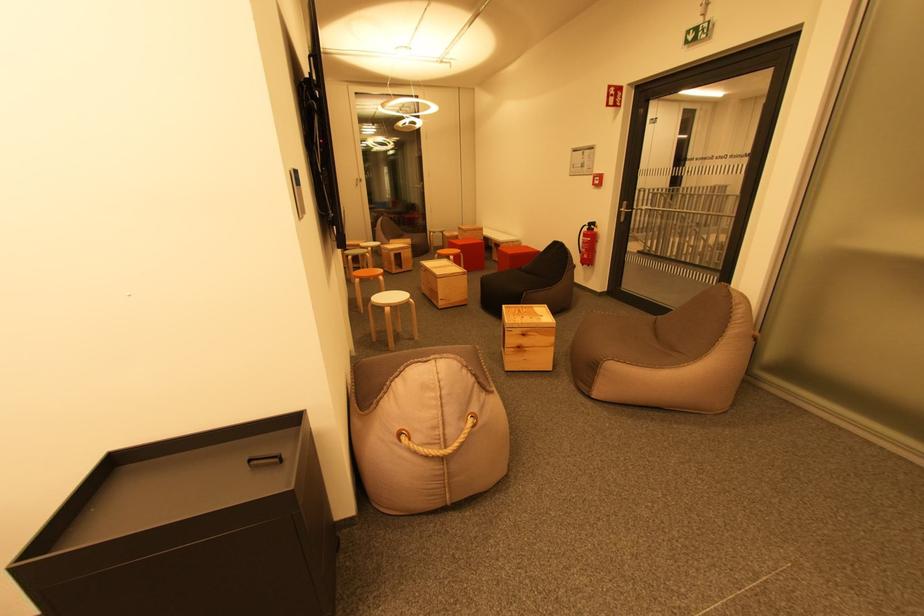
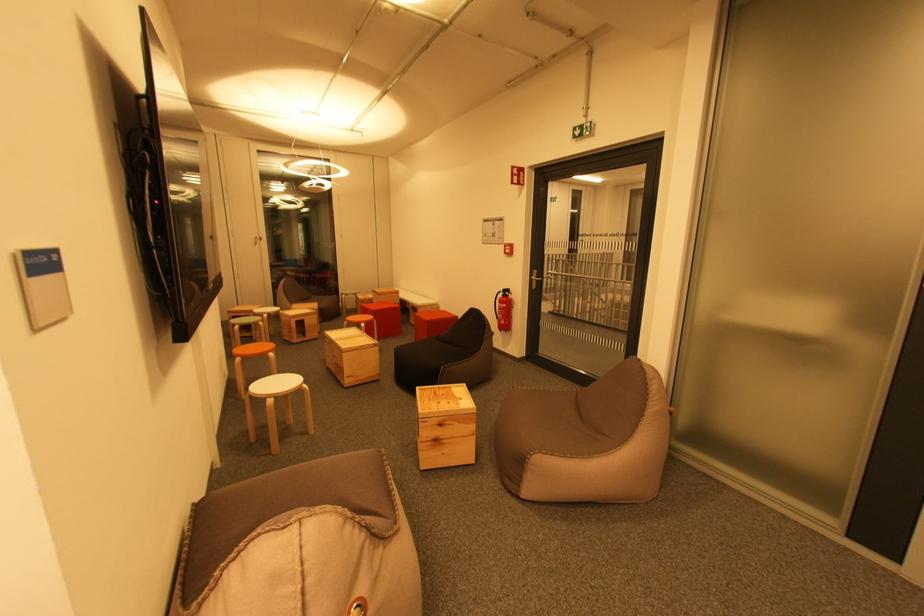
What movement of the cameraman would produce the second image?

The cameraman moved toward right, forward.